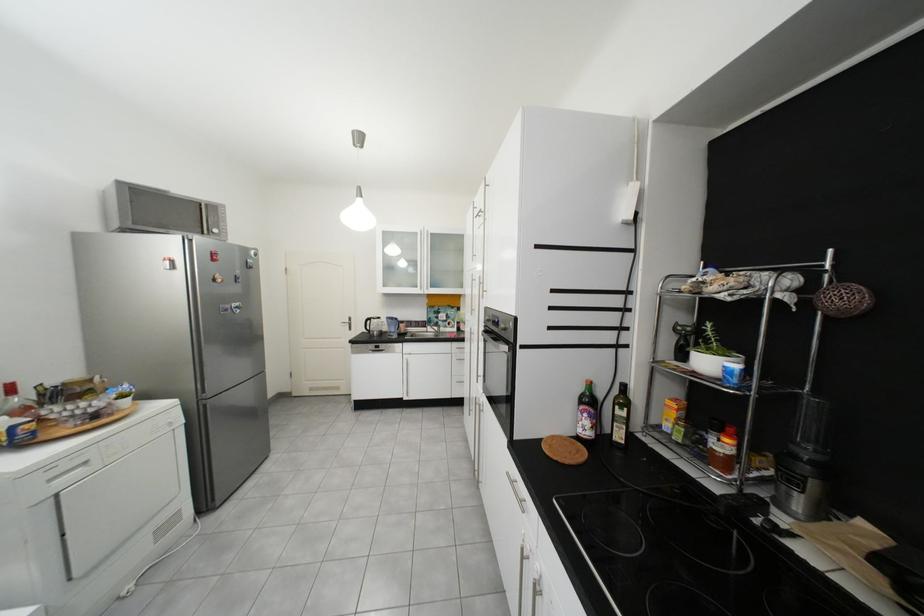
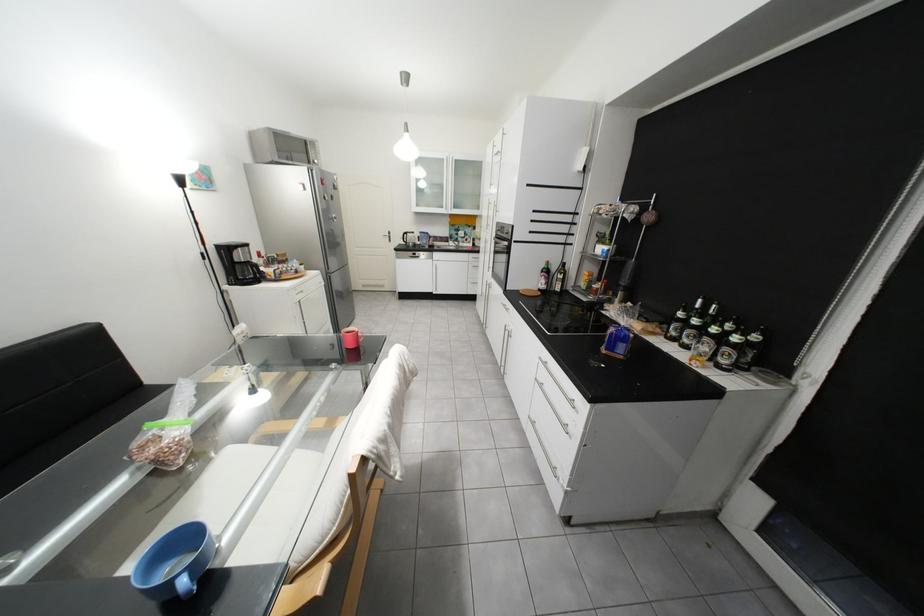
The point at (407, 338) is marked in the first image. Where is the corresponding point in the second image?

(439, 248)